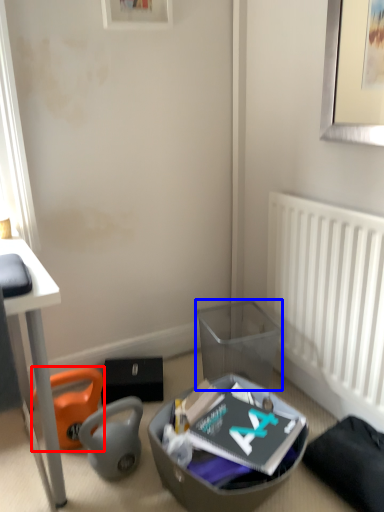
Question: Which object appears closest to the camera in this image, bean bag chair (highlighted by a red box) or trash bin/can (highlighted by a blue box)?

Choices:
 (A) bean bag chair
 (B) trash bin/can

Answer: (A)